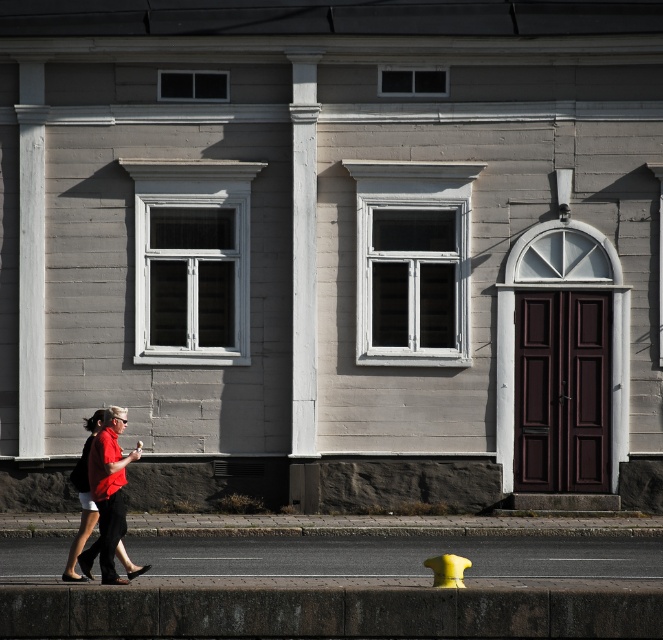
You are a delivery person trying to park your 2.5 meter tall delivery robot in front of the building. The robot needs to be placed between the smooth concrete sidewalk at lower center and the yellow rubber hydrant at lower center. Can the robot fit vertically between them?

The smooth concrete sidewalk at lower center is taller than the yellow rubber hydrant at lower center. The vertical space between them is determined by their height difference. Since the sidewalk is taller, the available vertical clearance would be the height of the hydrant. If the robot is 2.5 meters tall, it might not fit unless the hydrant is at least that tall, but since the sidewalk is taller, the vertical clearance is limited by the hydrant height. The answer depends on exact measurements, but based o

You are standing in front of the building and see the smooth concrete sidewalk at lower center and the matte red shirt at lower left. Which object is closer to the ground?

The smooth concrete sidewalk at lower center is closer to the ground because it is positioned below the matte red shirt at lower left.

You are standing on the smooth concrete sidewalk at lower center and looking towards the building. Can you see the matte red shirt at lower left from your current position?

The matte red shirt at lower left is behind the smooth concrete sidewalk at lower center, so it is not visible from your current position on the sidewalk.